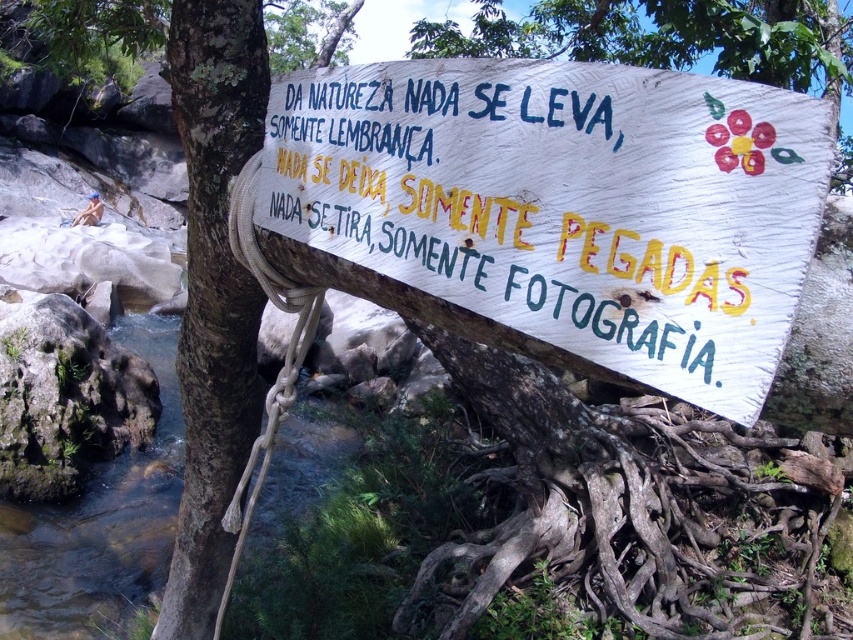
You are standing at the point with coordinates (567, 204) in the image. What object are you directly in front of?

You are directly in front of the white wooden sign at center, as the point (567, 204) represents its location.

You are standing at the center of the image and want to take a photo of the white wooden sign at center and the clear water at creek right. Which object is closer to your current position?

The white wooden sign at center is closer to your current position because it is positioned on the right side of the clear water at creek right, meaning the sign is between you and the creek.

You are a painter standing 30 inches away from the white wooden sign at center. You want to paint the sign but need to be at least 2 feet away to avoid splashing paint on it. Is your current distance sufficient?

The distance between you and the white wooden sign at center is 25.92 inches. Since 2 feet equals 24 inches, your current distance of 25.92 inches is sufficient as it exceeds the minimum required distance of 24 inches.